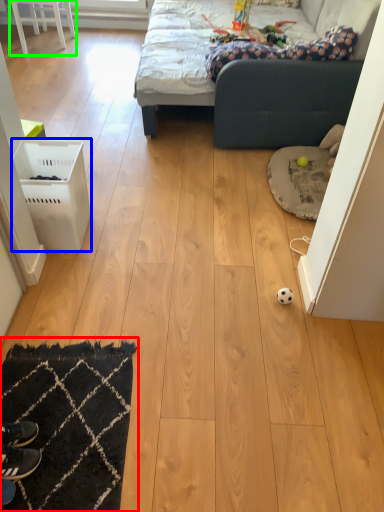
Question: Considering the real-world distances, which object is closest to mat (highlighted by a red box)? laundry basket (highlighted by a blue box) or furniture (highlighted by a green box).

Choices:
 (A) laundry basket
 (B) furniture

Answer: (A)